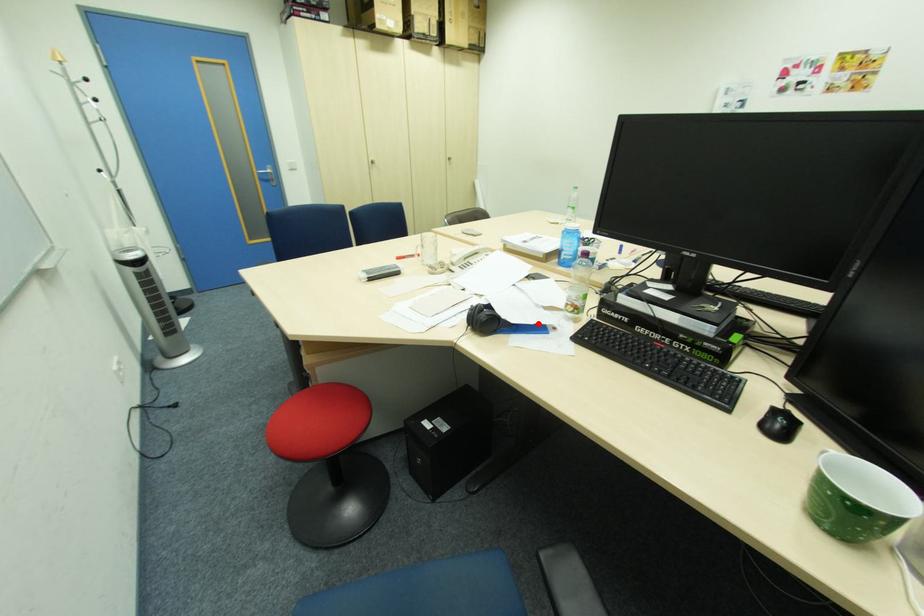
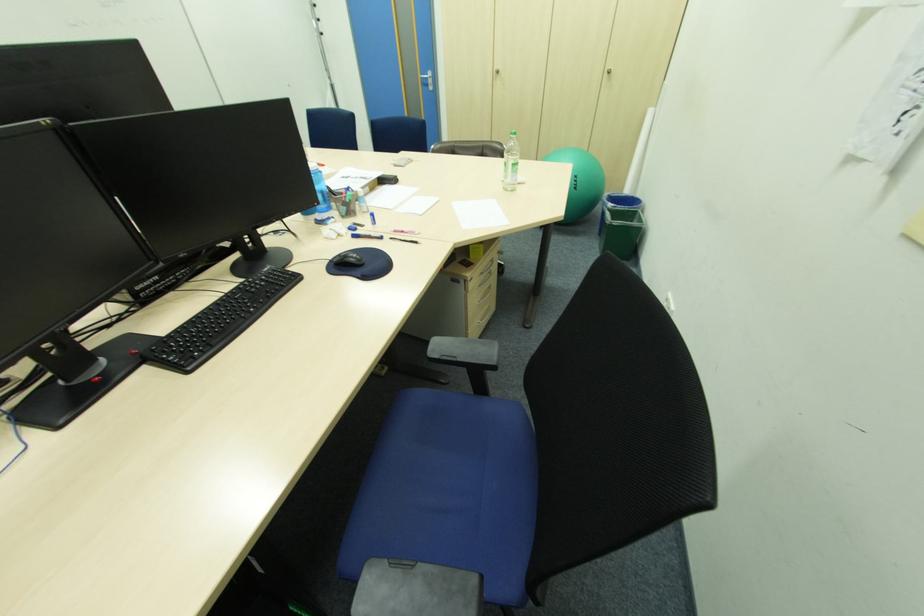
Question: I am providing you with two images of the same scene from different viewpoints. A red point is marked on the first image. Can you still see the location of the red point in image 2?

Choices:
 (A) Yes
 (B) No

Answer: (B)